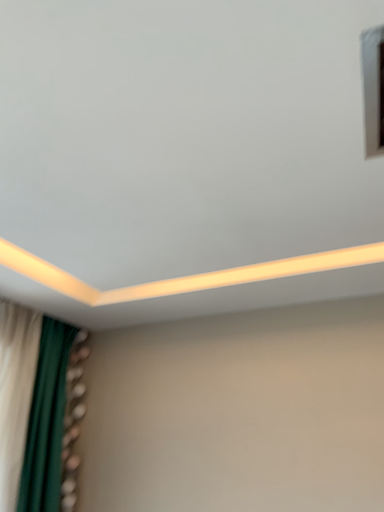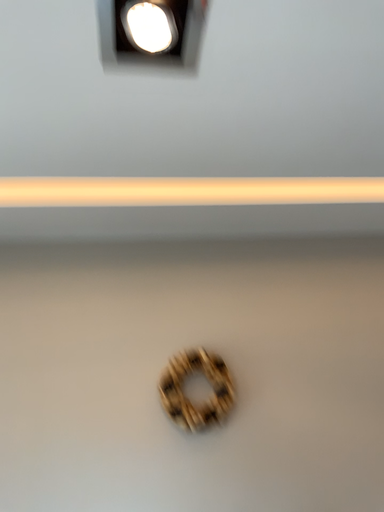
Question: Which way did the camera rotate in the video?

Choices:
 (A) rotated left
 (B) rotated right

Answer: (B)